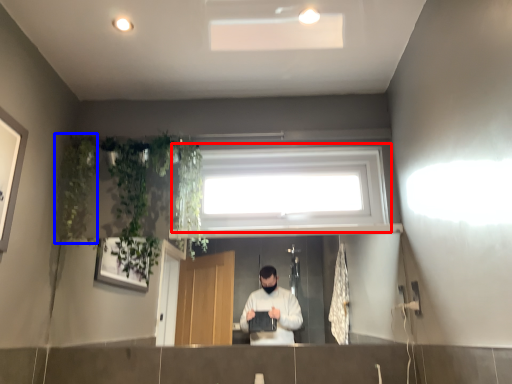
Question: Which object is further to the camera taking this photo, window (highlighted by a red box) or plant (highlighted by a blue box)?

Choices:
 (A) window
 (B) plant

Answer: (A)